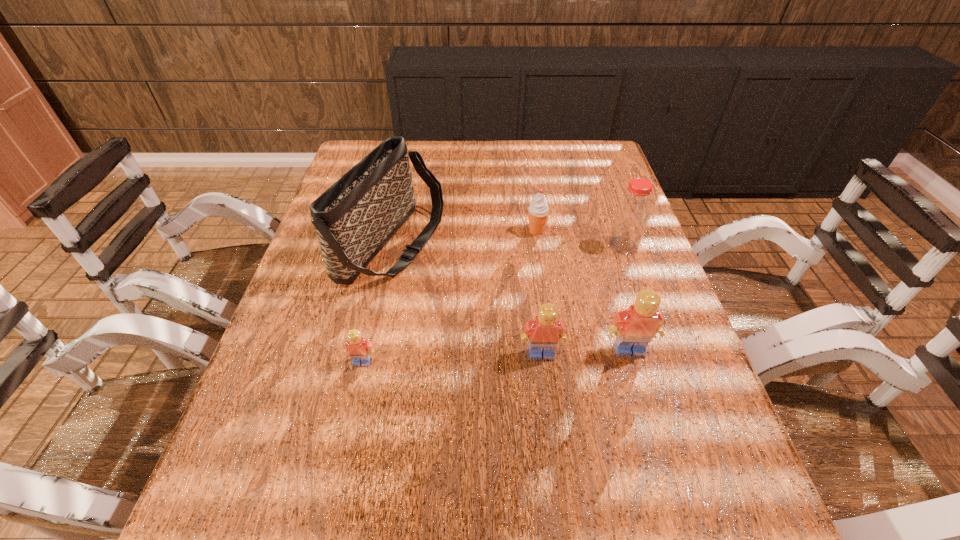
This screenshot has height=540, width=960. I want to click on vacant space located on the right of the icecream, so click(x=597, y=231).

Find the location of `vacant position located 0.130m on the left of the bottle`. vacant position located 0.130m on the left of the bottle is located at coordinates (559, 246).

Where is `free space located on the right of the handbag`? free space located on the right of the handbag is located at coordinates (531, 246).

The height and width of the screenshot is (540, 960). Identify the location of object located in the left edge section of the desktop. (354, 219).

This screenshot has width=960, height=540. In order to click on Lego that is positioned at the right edge in this screenshot , I will do `click(634, 328)`.

Find the location of a particular element. The height and width of the screenshot is (540, 960). bottle that is positioned at the right edge is located at coordinates (632, 214).

The width and height of the screenshot is (960, 540). Find the location of `free spot at the far edge of the desktop`. free spot at the far edge of the desktop is located at coordinates (520, 172).

I want to click on vacant region at the near edge of the desktop, so click(x=336, y=470).

Where is `blank space at the left edge of the desktop`? This screenshot has height=540, width=960. blank space at the left edge of the desktop is located at coordinates (322, 271).

Where is `free space at the right edge of the desktop`? The width and height of the screenshot is (960, 540). free space at the right edge of the desktop is located at coordinates (589, 180).